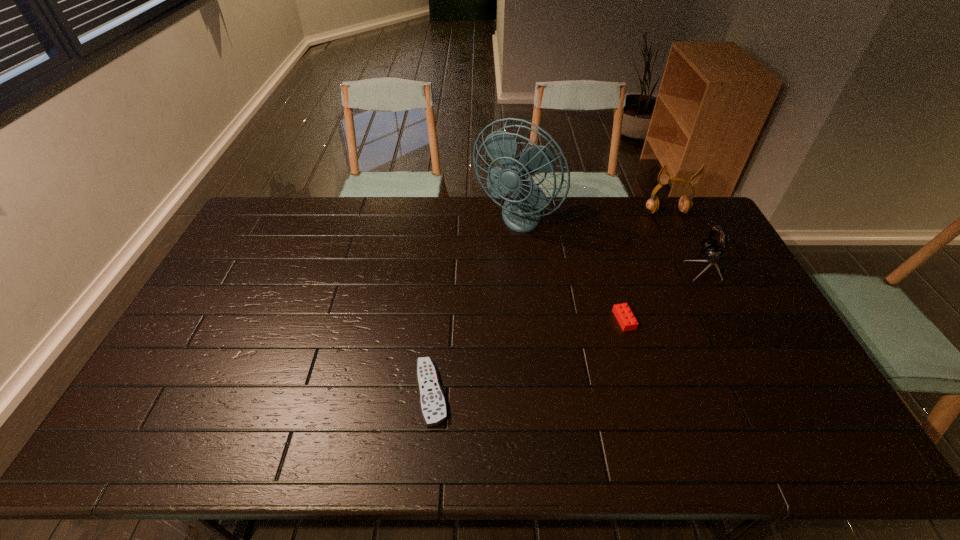
Where is `the fourth object from right to left`? the fourth object from right to left is located at coordinates (521, 212).

Where is `the tallest object`? This screenshot has width=960, height=540. the tallest object is located at coordinates (521, 212).

What are the coordinates of `the farther earphone` in the screenshot? It's located at (685, 204).

At what (x,y) coordinates should I click in order to perform the action: click on the fourth shortest object. Please return your answer as a coordinate pair (x, y). Looking at the image, I should click on (685, 204).

Identify the location of the third farthest object. Image resolution: width=960 pixels, height=540 pixels. (712, 252).

Where is `the shorter earphone`? the shorter earphone is located at coordinates (712, 252).

At what (x,y) coordinates should I click in order to perform the action: click on the second nearest object. Please return your answer as a coordinate pair (x, y). Image resolution: width=960 pixels, height=540 pixels. Looking at the image, I should click on (626, 319).

This screenshot has width=960, height=540. I want to click on the fourth tallest object, so click(626, 319).

Where is `the shortest object`? The height and width of the screenshot is (540, 960). the shortest object is located at coordinates (433, 407).

Where is `the leftmost object`? The image size is (960, 540). the leftmost object is located at coordinates (433, 407).